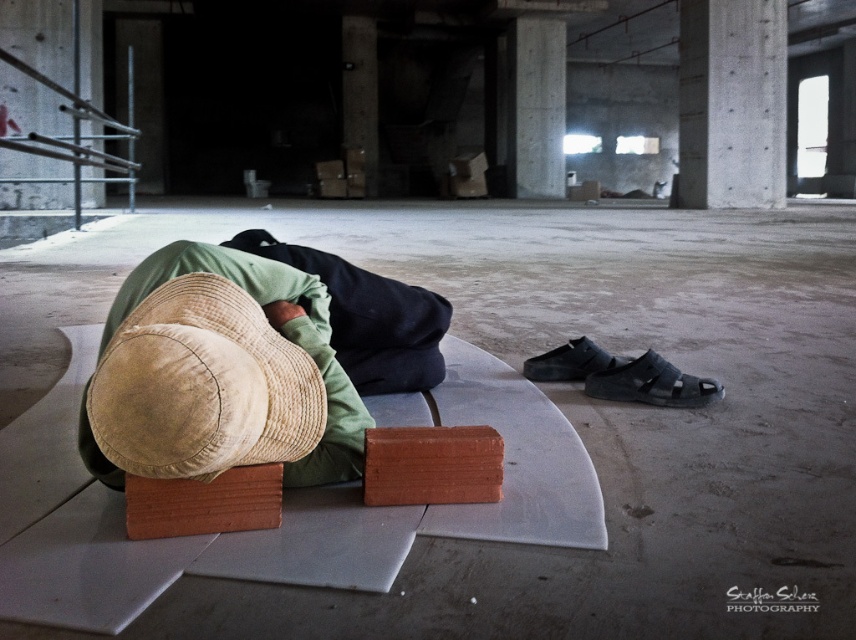
Question: Can you confirm if orange brick at center is wider than tan straw hat at center?

Choices:
 (A) no
 (B) yes

Answer: (B)

Question: Can you confirm if tan straw hat at center is positioned above concrete at upper right?

Choices:
 (A) yes
 (B) no

Answer: (B)

Question: Is orange brick at center to the left of tan straw hat at center from the viewer's perspective?

Choices:
 (A) yes
 (B) no

Answer: (B)

Question: Estimate the real-world distances between objects in this image. Which object is closer to the orange brick at center?

Choices:
 (A) concrete/cement pillar at upper center
 (B) tan straw hat at center
 (C) concrete at upper right

Answer: (B)

Question: Which point is closer to the camera?

Choices:
 (A) concrete/cement pillar at upper center
 (B) tan straw hat at center
 (C) orange brick at center

Answer: (B)

Question: Which object is farther from the camera taking this photo?

Choices:
 (A) concrete at upper right
 (B) orange brick at center
 (C) tan straw hat at center

Answer: (A)